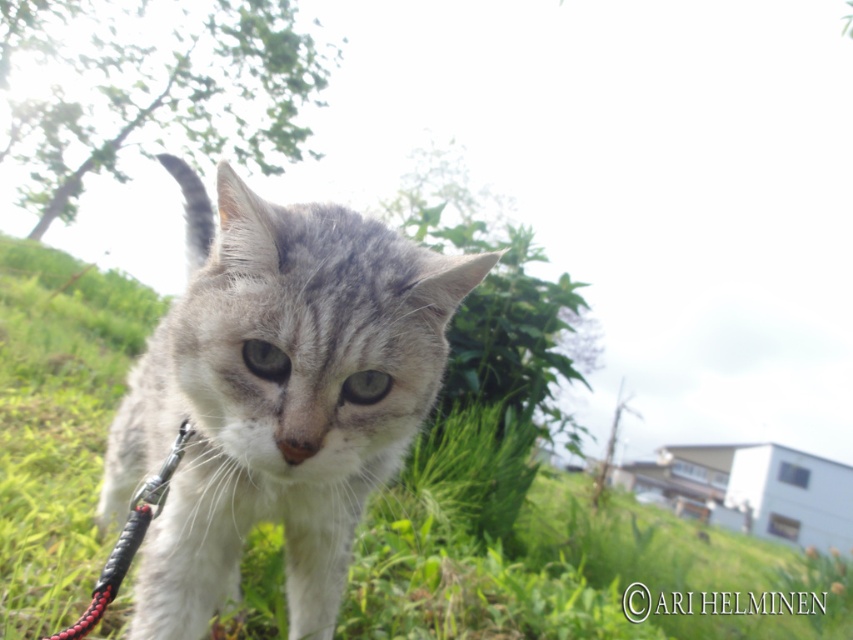
Looking at this image, you are a photographer trying to capture the gray fur cat at center and the green grassy at center in the same frame. Based on their positions, which object is located to the right of the other?

The green grassy at center is positioned on the right side of gray fur cat at center, so the green grassy at center is to the right of the gray fur cat at center.

You are a photographer trying to capture a clear shot of the gray fur cat at center while standing on the green grassy at center. Can you step forward to get closer to the cat without moving the cat?

The green grassy at center is further to the viewer than gray fur cat at center, so stepping forward on the green grassy at center would bring you closer to the cat.

You are a photographer trying to focus on two points in the image of the cat. The first point is at coordinates point (688, 577) and the second is at point (247, 268). Which point is closer to you, the photographer?

Point (688, 577) is further to the viewer than point (247, 268), so the second point is closer to you.